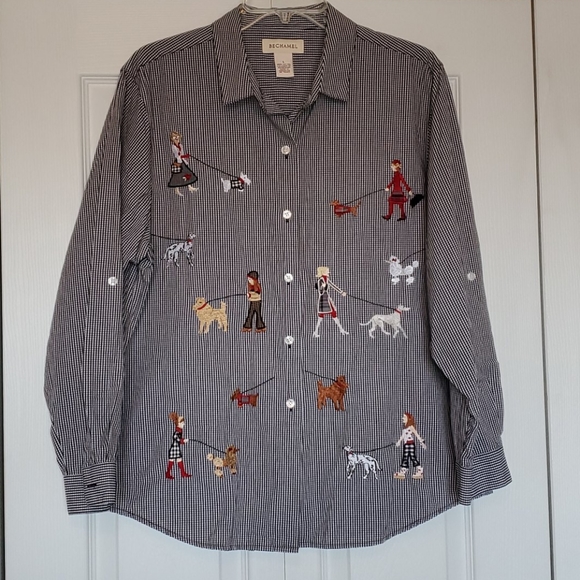
The width and height of the screenshot is (580, 580). I want to click on artwork top left, so click(211, 177).